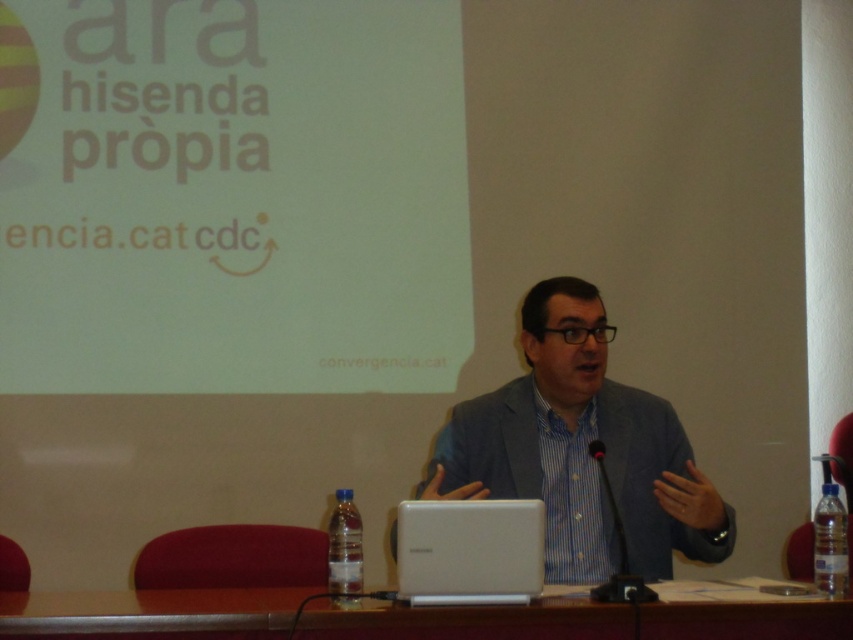
You are organizing a small event and need to place a 1.5 meter long banner on the table. Given the wooden table at center and the black plastic microphone at center, can the banner fit on the table without covering the microphone?

The wooden table at center is larger in size than the black plastic microphone at center, so the banner can fit on the table without covering the microphone as there is enough space.

You are an event planner setting up a presentation room. You need to ensure that the white matte projection screen at upper center is visible to all attendees. Given that the wooden table at center is where the presenter will stand, is the screen positioned correctly?

The white matte projection screen at upper center is above the wooden table at center, which means it is positioned correctly so that the presenter can face the audience while the screen remains visible to everyone in the room.